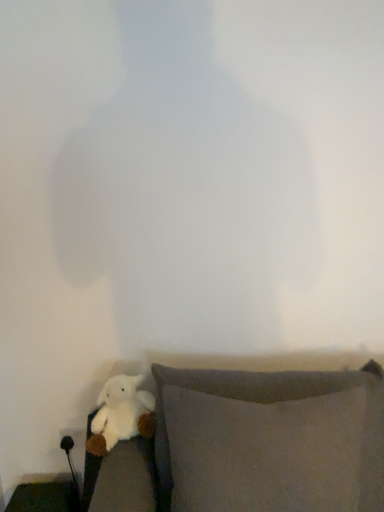
Question: Should I look upward or downward to see gray fabric pillow at lower right, the 1th furniture positioned from the top?

Choices:
 (A) down
 (B) up

Answer: (A)

Question: From a real-world perspective, is gray fabric pillow at lower right, the 1th furniture positioned from the top, located higher than white plush toy at lower left?

Choices:
 (A) no
 (B) yes

Answer: (A)

Question: Does gray fabric pillow at lower right, which is the 2th furniture in bottom-to-top order, have a larger size compared to white plush toy at lower left?

Choices:
 (A) no
 (B) yes

Answer: (B)

Question: Is gray fabric pillow at lower right, the 1th furniture when ordered from right to left, to the right of white plush toy at lower left from the viewer's perspective?

Choices:
 (A) yes
 (B) no

Answer: (A)

Question: Is gray fabric pillow at lower right, the 1th furniture when ordered from right to left, further to camera compared to white plush toy at lower left?

Choices:
 (A) yes
 (B) no

Answer: (B)

Question: Considering the relative sizes of gray fabric pillow at lower right, which is counted as the 1th furniture, starting from the front, and white plush toy at lower left in the image provided, is gray fabric pillow at lower right, which is counted as the 1th furniture, starting from the front, thinner than white plush toy at lower left?

Choices:
 (A) no
 (B) yes

Answer: (A)

Question: Is gray fabric pillow at lower right, acting as the second furniture starting from the back, to the left of white plush toy at lower left from the viewer's perspective?

Choices:
 (A) yes
 (B) no

Answer: (B)

Question: Is white plush toy at lower left closer to the viewer compared to gray fabric pillow at lower right, the 1th furniture positioned from the top?

Choices:
 (A) no
 (B) yes

Answer: (A)

Question: Considering the relative sizes of white plush toy at lower left and gray fabric pillow at lower right, the 1th furniture when ordered from right to left, in the image provided, is white plush toy at lower left shorter than gray fabric pillow at lower right, the 1th furniture when ordered from right to left,?

Choices:
 (A) yes
 (B) no

Answer: (A)

Question: Can you confirm if white plush toy at lower left is bigger than gray fabric pillow at lower right, placed as the second furniture when sorted from left to right?

Choices:
 (A) yes
 (B) no

Answer: (B)

Question: Would you say gray fabric pillow at lower right, the 1th furniture when ordered from right to left, is part of white plush toy at lower left's contents?

Choices:
 (A) yes
 (B) no

Answer: (B)

Question: From a real-world perspective, is white plush toy at lower left positioned over gray fabric pillow at lower right, the 1th furniture when ordered from right to left, based on gravity?

Choices:
 (A) no
 (B) yes

Answer: (B)

Question: Is white plush toy at lower left to the left of gray fabric pillow at lower right, acting as the second furniture starting from the back, from the viewer's perspective?

Choices:
 (A) yes
 (B) no

Answer: (A)

Question: Considering the relative sizes of white plush toy at lower left and matte black side table at lower left, arranged as the second furniture when viewed from the right, in the image provided, is white plush toy at lower left bigger than matte black side table at lower left, arranged as the second furniture when viewed from the right,?

Choices:
 (A) yes
 (B) no

Answer: (B)